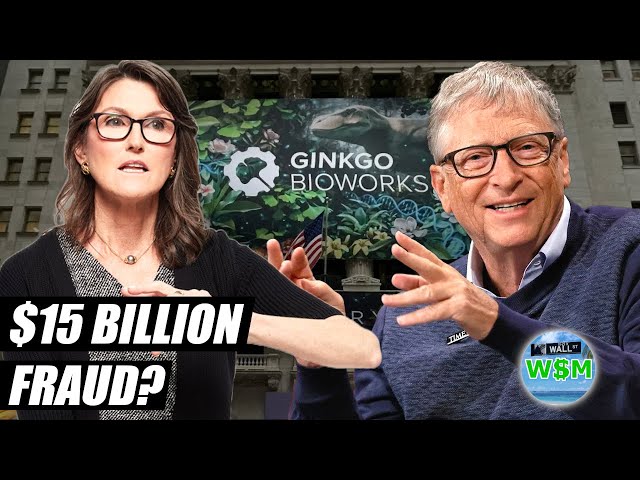
Locate an element on the screen. windows is located at coordinates (47, 123), (628, 152).